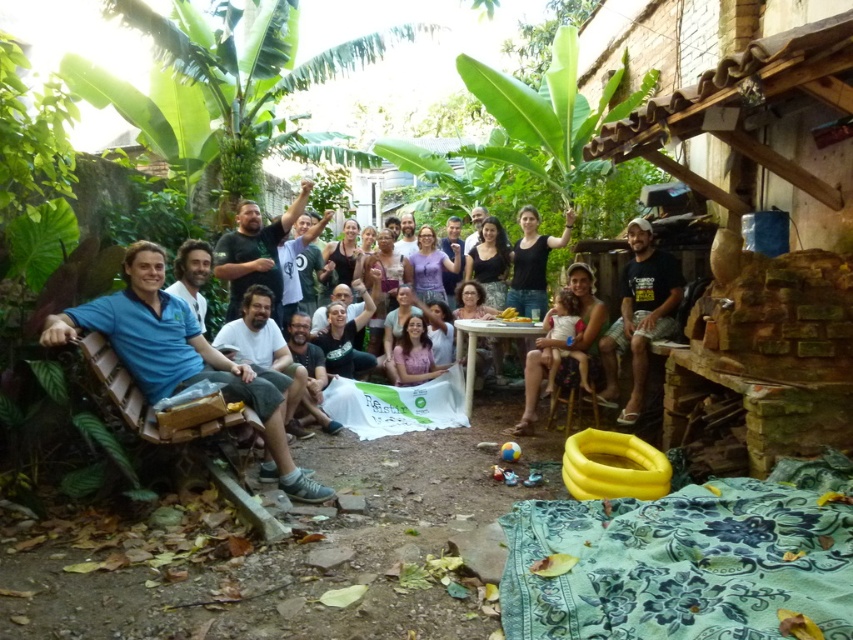
Question: Which of the following is the closest to the observer?

Choices:
 (A) black cotton t-shirt at right
 (B) blue fabric bench at left

Answer: (B)

Question: Observing the image, what is the correct spatial positioning of blue fabric bench at left in reference to black cotton t-shirt at right?

Choices:
 (A) below
 (B) above

Answer: (A)

Question: Can you confirm if blue fabric bench at left is positioned to the right of black cotton t-shirt at right?

Choices:
 (A) yes
 (B) no

Answer: (B)

Question: Which point appears farthest from the camera in this image?

Choices:
 (A) (283, 456)
 (B) (654, 304)

Answer: (B)

Question: Is blue fabric bench at left smaller than black cotton t-shirt at right?

Choices:
 (A) yes
 (B) no

Answer: (B)

Question: Which of the following is the closest to the observer?

Choices:
 (A) black cotton t-shirt at right
 (B) blue fabric bench at left

Answer: (B)